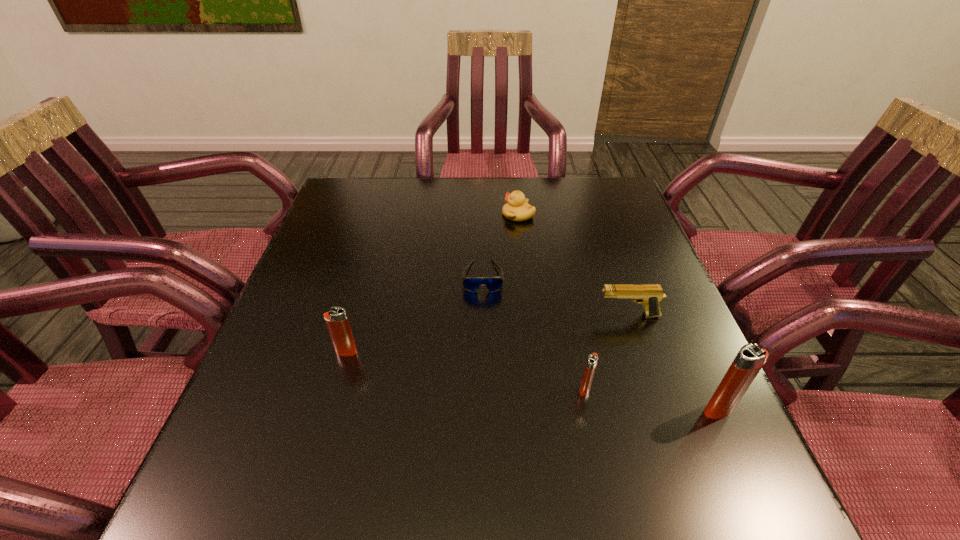
Please point a location where one more igniter can be added evenly. Please provide its 2D coordinates. Your answer should be formatted as a tuple, i.e. [(x, y)], where the tuple contains the x and y coordinates of a point satisfying the conditions above.

[(461, 370)]